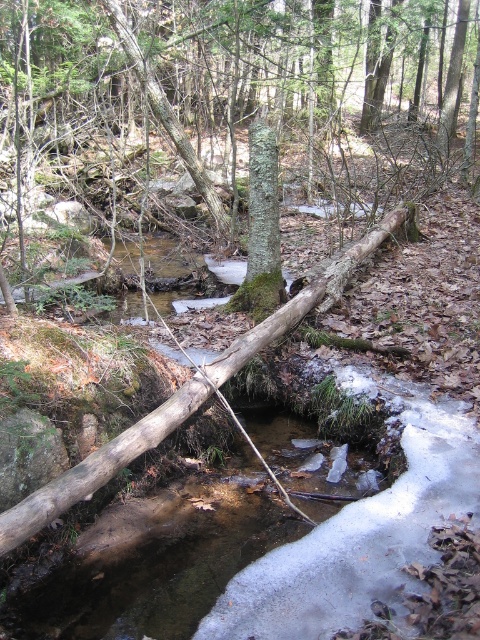
Is green rough bark tree at center taller than green rough bark tree trunk at center?

Yes.

Does point (97, 36) come in front of point (276, 196)?

No.

Image resolution: width=480 pixels, height=640 pixels. I want to click on green rough bark tree at center, so click(241, 81).

Describe the element at coordinates (156, 561) in the screenshot. This screenshot has width=480, height=640. I see `clear water at center` at that location.

Is point (229, 548) more distant than point (269, 172)?

That is False.

Does point (163, 502) come farther from viewer compared to point (267, 188)?

No, it is in front of (267, 188).

The height and width of the screenshot is (640, 480). Identify the location of clear water at center. (156, 561).

Is green rough bark tree at center above clear water at center?

Indeed, green rough bark tree at center is positioned over clear water at center.

Based on the photo, does green rough bark tree at center appear on the left side of clear water at center?

In fact, green rough bark tree at center is to the right of clear water at center.

Who is more forward, (x=192, y=164) or (x=127, y=570)?

Point (x=127, y=570) is in front.

This screenshot has width=480, height=640. I want to click on green rough bark tree at center, so click(x=241, y=81).